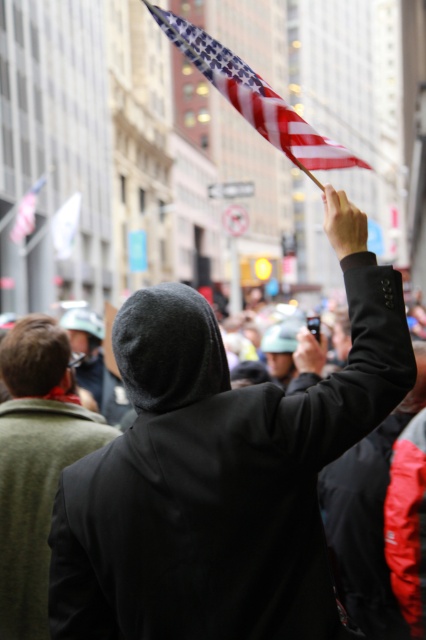
Can you confirm if black matte coat at upper center is positioned to the left of american flag at upper left?

In fact, black matte coat at upper center is to the right of american flag at upper left.

Who is more distant from viewer, (101,536) or (25,196)?

The point (25,196) is more distant.

Between point (54, 536) and point (16, 230), which one is positioned in front?

Point (54, 536)

The image size is (426, 640). What are the coordinates of `black matte coat at upper center` in the screenshot? It's located at (216, 477).

Describe the element at coordinates (36, 464) in the screenshot. I see `dark gray hoodie at center` at that location.

Who is lower down, dark gray hoodie at center or matte black phone at upper right?

Positioned lower is dark gray hoodie at center.

Between point (57, 408) and point (301, 368), which one is positioned behind?

The point (301, 368) is more distant.

Image resolution: width=426 pixels, height=640 pixels. In order to click on dark gray hoodie at center in this screenshot , I will do `click(36, 464)`.

Can you confirm if dark gray hoodie at center is bigger than white fabric flag at upper left?

No.

Can you confirm if dark gray hoodie at center is positioned to the left of white fabric flag at upper left?

Incorrect, dark gray hoodie at center is not on the left side of white fabric flag at upper left.

The width and height of the screenshot is (426, 640). Find the location of `dark gray hoodie at center`. dark gray hoodie at center is located at coordinates (36, 464).